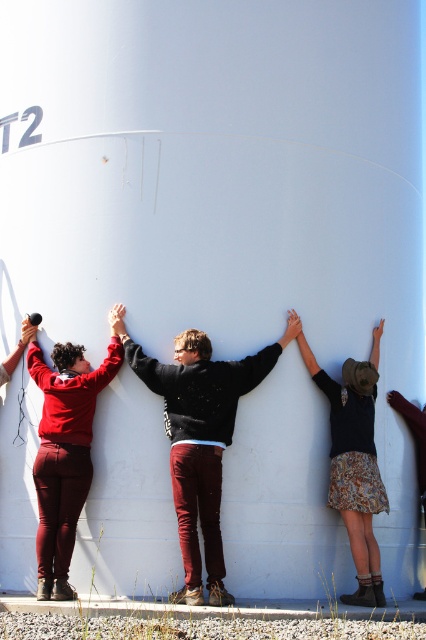
Question: Is matte red pants at left above patterned skirt at center?

Choices:
 (A) yes
 (B) no

Answer: (A)

Question: Which point appears farthest from the camera in this image?

Choices:
 (A) (147, 378)
 (B) (66, 358)

Answer: (B)

Question: Considering the relative positions of dark gray sweater at center and patterned skirt at center in the image provided, where is dark gray sweater at center located with respect to patterned skirt at center?

Choices:
 (A) right
 (B) left

Answer: (B)

Question: Does dark gray sweater at center have a larger size compared to patterned skirt at center?

Choices:
 (A) yes
 (B) no

Answer: (A)

Question: Which point is closer to the camera?

Choices:
 (A) (57, 596)
 (B) (373, 440)
 (C) (176, 349)

Answer: (A)

Question: Which of the following is the closest to the observer?

Choices:
 (A) (48, 577)
 (B) (377, 579)

Answer: (A)